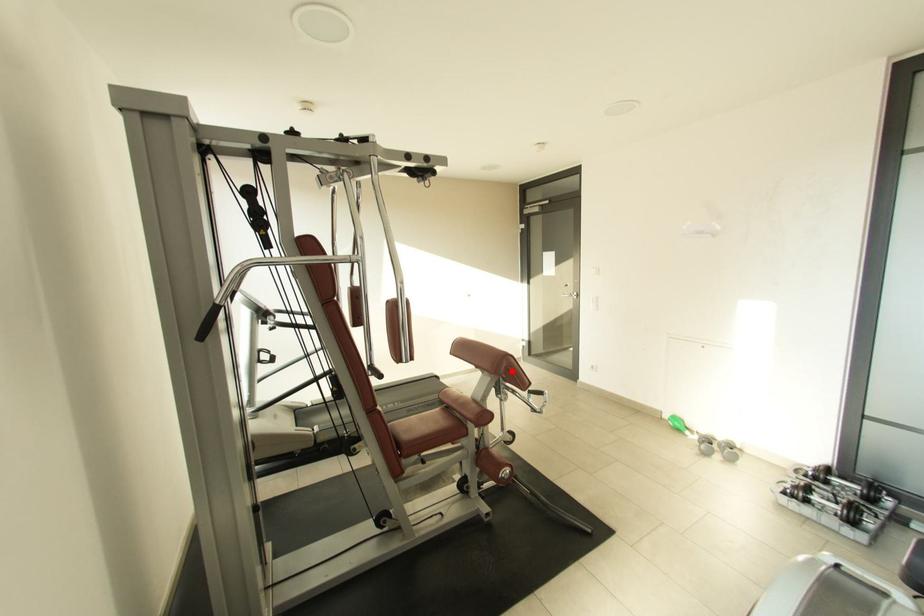
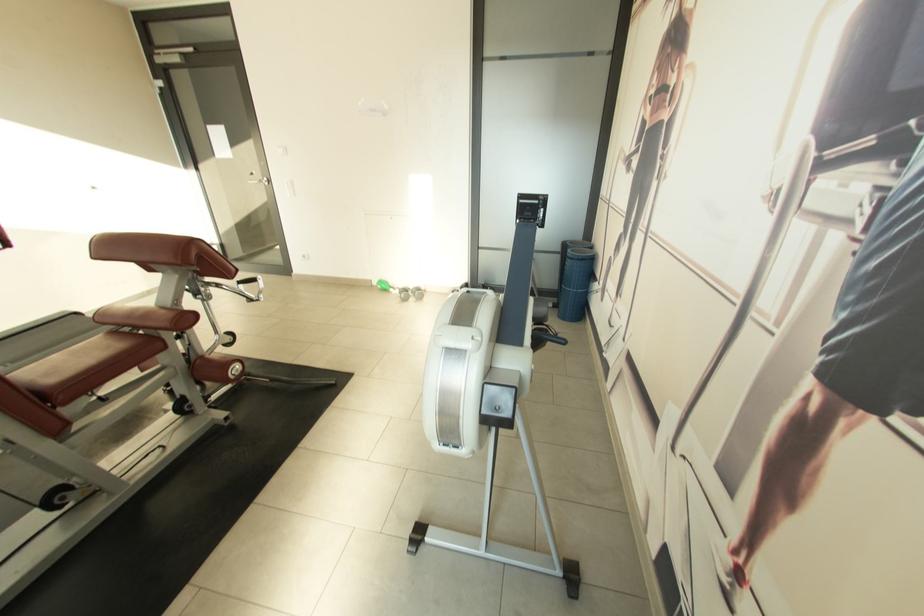
In the second image, find the point that corresponds to the highlighted location in the first image.

(204, 257)